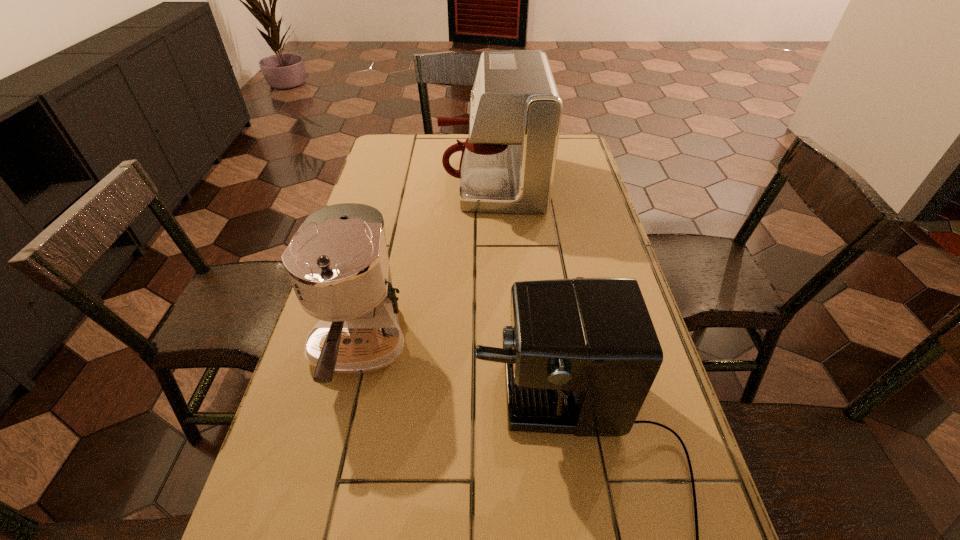
Where is `the farthest object`? The width and height of the screenshot is (960, 540). the farthest object is located at coordinates (507, 165).

This screenshot has width=960, height=540. Identify the location of the tallest coffee maker. (507, 165).

Identify the location of the second tallest object. (338, 264).

Where is `the leftmost object`? The image size is (960, 540). the leftmost object is located at coordinates (338, 264).

The width and height of the screenshot is (960, 540). I want to click on vacant region located on the front of the farthest object near the spout, so click(371, 181).

Find the location of `free space located on the front of the farthest object near the spout`. free space located on the front of the farthest object near the spout is located at coordinates (424, 181).

The height and width of the screenshot is (540, 960). I want to click on free region located on the front of the farthest object near the spout, so 416,181.

You are a GUI agent. You are given a task and a screenshot of the screen. Output one action in this format:
    pyautogui.click(x=<x>, y=<y>)
    Task: Click on the free region located 0.170m on the front-facing side of the leftmost object
    The image size is (960, 540).
    Given the screenshot: What is the action you would take?
    pyautogui.click(x=319, y=517)

The image size is (960, 540). I want to click on object positioned at the far edge, so click(507, 165).

Where is `object present at the left edge`? object present at the left edge is located at coordinates (338, 264).